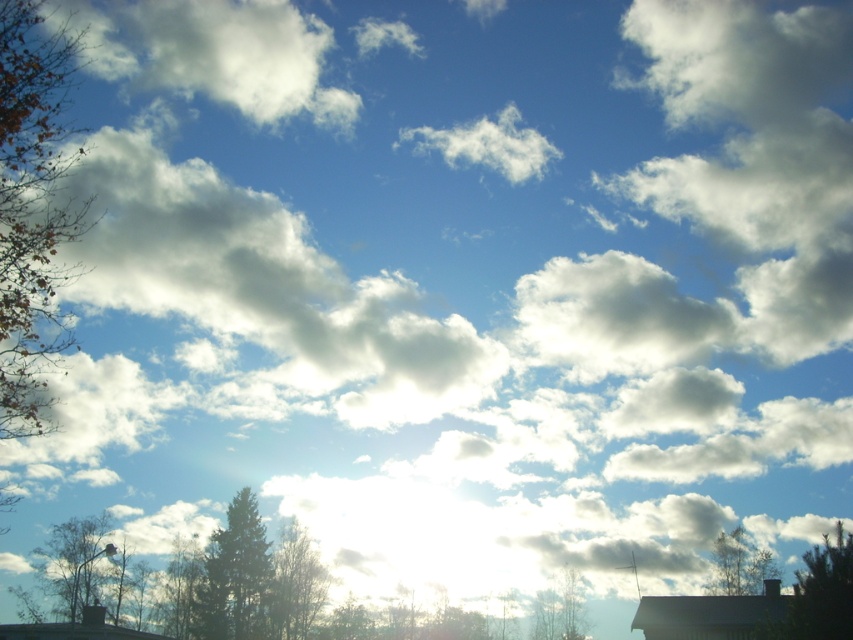
You are standing at the camera position and want to reach the point marked at coordinates point (13, 3). If your walking speed is 3 feet per second, how many seconds will it take you to reach that point?

The distance between point (13, 3) and the camera is 56.30 feet. At a walking speed of 3 feet per second, it will take approximately 18.77 seconds to reach the point.

You are an artist trying to sketch the scene. You need to decide which object to draw first based on their sizes. Which one should you start with, the white fluffy cloud at center or the green leafy tree at lower left?

You should start with the white fluffy cloud at center because its width surpasses that of the green leafy tree at lower left, making it larger and possibly requiring more attention first.